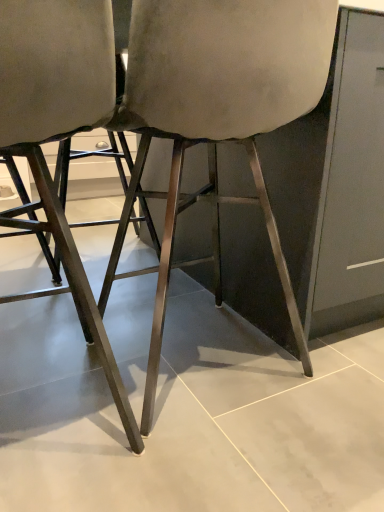
What is the approximate width of satin silver chair at center, which is the 2th chair from left to right?

The width of satin silver chair at center, which is the 2th chair from left to right, is 47.99 centimeters.

Describe the element at coordinates (216, 116) in the screenshot. This screenshot has width=384, height=512. I see `satin silver chair at center, which is the 2th chair from left to right` at that location.

Locate an element on the screen. This screenshot has height=512, width=384. satin silver chair at center, which is the 2th chair from left to right is located at coordinates (216, 116).

Identify the location of matte gray fabric chair at center, which is the 1th chair from left to right. (60, 130).

What is the approximate width of matte gray fabric chair at center, which is the 1th chair from left to right?

18.87 inches.

Describe the element at coordinates (60, 130) in the screenshot. I see `matte gray fabric chair at center, which is the 1th chair from left to right` at that location.

Locate an element on the screen. This screenshot has height=512, width=384. satin silver chair at center, which is the 2th chair from left to right is located at coordinates (216, 116).

From the picture: Is satin silver chair at center, which is the 2th chair from left to right, to the left or to the right of matte gray fabric chair at center, which is the 1th chair from left to right, in the image?

Based on their positions, satin silver chair at center, which is the 2th chair from left to right, is located to the right of matte gray fabric chair at center, which is the 1th chair from left to right.

Between satin silver chair at center, the 1th chair when ordered from right to left, and matte gray fabric chair at center, acting as the 2th chair starting from the right, which one is positioned behind?

satin silver chair at center, the 1th chair when ordered from right to left.

Is point (312, 23) in front of point (12, 137)?

No, it is behind (12, 137).

From the image's perspective, which one is positioned lower, satin silver chair at center, which is the 2th chair from left to right, or matte gray fabric chair at center, acting as the 2th chair starting from the right?

matte gray fabric chair at center, acting as the 2th chair starting from the right, from the image's perspective.

Consider the image. From a real-world perspective, who is located higher, satin silver chair at center, which is the 2th chair from left to right, or matte gray fabric chair at center, which is the 1th chair from left to right?

satin silver chair at center, which is the 2th chair from left to right.

Considering the sizes of objects satin silver chair at center, the 1th chair when ordered from right to left, and matte gray fabric chair at center, acting as the 2th chair starting from the right, in the image provided, who is wider, satin silver chair at center, the 1th chair when ordered from right to left, or matte gray fabric chair at center, acting as the 2th chair starting from the right,?

With larger width is satin silver chair at center, the 1th chair when ordered from right to left.

Considering the sizes of satin silver chair at center, the 1th chair when ordered from right to left, and matte gray fabric chair at center, which is the 1th chair from left to right, in the image, is satin silver chair at center, the 1th chair when ordered from right to left, taller or shorter than matte gray fabric chair at center, which is the 1th chair from left to right,?

In the image, satin silver chair at center, the 1th chair when ordered from right to left, appears to be taller than matte gray fabric chair at center, which is the 1th chair from left to right.

Does satin silver chair at center, which is the 2th chair from left to right, have a smaller size compared to matte gray fabric chair at center, which is the 1th chair from left to right?

Actually, satin silver chair at center, which is the 2th chair from left to right, might be larger than matte gray fabric chair at center, which is the 1th chair from left to right.

Would you say matte gray fabric chair at center, acting as the 2th chair starting from the right, is part of satin silver chair at center, which is the 2th chair from left to right,'s contents?

No, matte gray fabric chair at center, acting as the 2th chair starting from the right, is not inside satin silver chair at center, which is the 2th chair from left to right.

Can you see satin silver chair at center, which is the 2th chair from left to right, touching matte gray fabric chair at center, which is the 1th chair from left to right?

No.

Is satin silver chair at center, the 1th chair when ordered from right to left, aimed at matte gray fabric chair at center, acting as the 2th chair starting from the right?

No, satin silver chair at center, the 1th chair when ordered from right to left, does not turn towards matte gray fabric chair at center, acting as the 2th chair starting from the right.

What's the angular difference between satin silver chair at center, the 1th chair when ordered from right to left, and matte gray fabric chair at center, acting as the 2th chair starting from the right,'s facing directions?

The angular difference between satin silver chair at center, the 1th chair when ordered from right to left, and matte gray fabric chair at center, acting as the 2th chair starting from the right, is 0.000208 degrees.

In the image, there is a satin silver chair at center, the 1th chair when ordered from right to left. Where is `chair below it (from the image's perspective)`? chair below it (from the image's perspective) is located at coordinates (60, 130).

In the scene shown: Visually, is matte gray fabric chair at center, acting as the 2th chair starting from the right, positioned to the left or to the right of satin silver chair at center, the 1th chair when ordered from right to left?

From the image, it's evident that matte gray fabric chair at center, acting as the 2th chair starting from the right, is to the left of satin silver chair at center, the 1th chair when ordered from right to left.

Between matte gray fabric chair at center, acting as the 2th chair starting from the right, and satin silver chair at center, which is the 2th chair from left to right, which one is positioned in front?

matte gray fabric chair at center, acting as the 2th chair starting from the right.

Is point (25, 52) positioned before point (280, 69)?

Yes, point (25, 52) is in front of point (280, 69).

From the image's perspective, which one is positioned lower, matte gray fabric chair at center, which is the 1th chair from left to right, or satin silver chair at center, which is the 2th chair from left to right?

matte gray fabric chair at center, which is the 1th chair from left to right, appears lower in the image.

From a real-world perspective, is matte gray fabric chair at center, acting as the 2th chair starting from the right, positioned above or below satin silver chair at center, the 1th chair when ordered from right to left?

From a real-world perspective, matte gray fabric chair at center, acting as the 2th chair starting from the right, is physically below satin silver chair at center, the 1th chair when ordered from right to left.

Looking at this image, looking at their sizes, would you say matte gray fabric chair at center, acting as the 2th chair starting from the right, is wider or thinner than satin silver chair at center, which is the 2th chair from left to right?

Considering their sizes, matte gray fabric chair at center, acting as the 2th chair starting from the right, looks slimmer than satin silver chair at center, which is the 2th chair from left to right.

Considering the sizes of matte gray fabric chair at center, acting as the 2th chair starting from the right, and satin silver chair at center, the 1th chair when ordered from right to left, in the image, is matte gray fabric chair at center, acting as the 2th chair starting from the right, taller or shorter than satin silver chair at center, the 1th chair when ordered from right to left,?

In the image, matte gray fabric chair at center, acting as the 2th chair starting from the right, appears to be shorter than satin silver chair at center, the 1th chair when ordered from right to left.

Is matte gray fabric chair at center, which is the 1th chair from left to right, bigger than satin silver chair at center, the 1th chair when ordered from right to left?

No.

Is matte gray fabric chair at center, which is the 1th chair from left to right, situated inside satin silver chair at center, the 1th chair when ordered from right to left, or outside?

matte gray fabric chair at center, which is the 1th chair from left to right, is spatially situated outside satin silver chair at center, the 1th chair when ordered from right to left.

Are matte gray fabric chair at center, which is the 1th chair from left to right, and satin silver chair at center, the 1th chair when ordered from right to left, far apart?

matte gray fabric chair at center, which is the 1th chair from left to right, is near satin silver chair at center, the 1th chair when ordered from right to left, not far away.

Is matte gray fabric chair at center, acting as the 2th chair starting from the right, oriented away from satin silver chair at center, the 1th chair when ordered from right to left?

No, matte gray fabric chair at center, acting as the 2th chair starting from the right, is not facing away from satin silver chair at center, the 1th chair when ordered from right to left.

Can you tell me how much matte gray fabric chair at center, which is the 1th chair from left to right, and satin silver chair at center, which is the 2th chair from left to right, differ in facing direction?

0.000208 degrees separate the facing orientations of matte gray fabric chair at center, which is the 1th chair from left to right, and satin silver chair at center, which is the 2th chair from left to right.

Image resolution: width=384 pixels, height=512 pixels. In order to click on chair located behind the matte gray fabric chair at center, acting as the 2th chair starting from the right in this screenshot , I will do `click(216, 116)`.

You are a GUI agent. You are given a task and a screenshot of the screen. Output one action in this format:
    pyautogui.click(x=<x>, y=<y>)
    Task: Click on the chair to the left of satin silver chair at center, which is the 2th chair from left to right
    This screenshot has width=384, height=512.
    Given the screenshot: What is the action you would take?
    pyautogui.click(x=60, y=130)

Identify the location of chair located behind the matte gray fabric chair at center, acting as the 2th chair starting from the right. (216, 116).